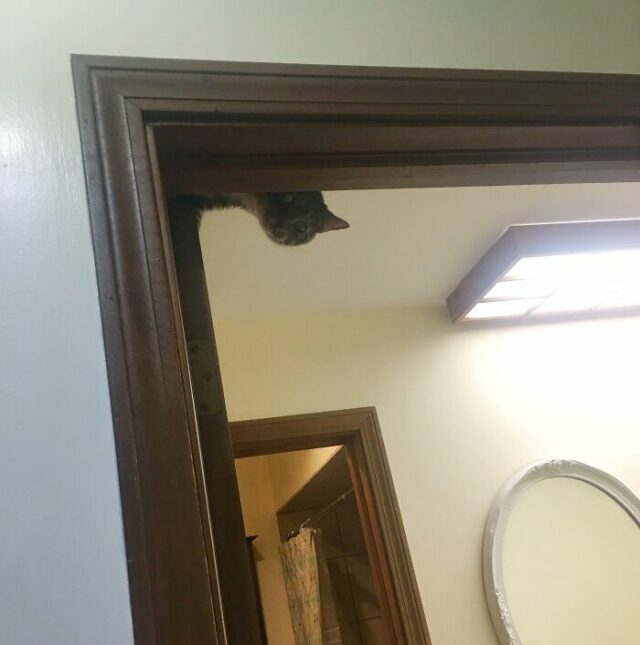
Find the location of `screws in door plate`. screws in door plate is located at coordinates (194, 348), (209, 377), (205, 406).